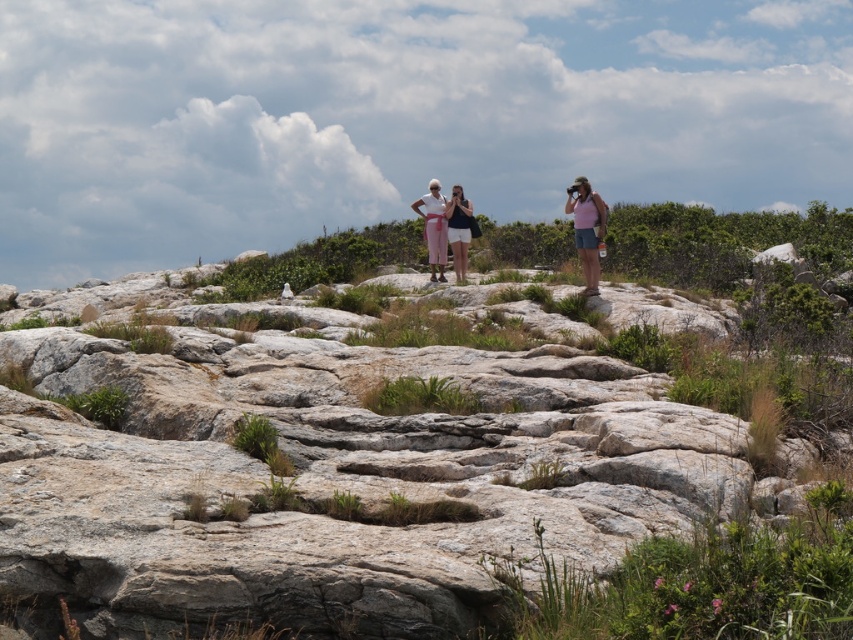
Which is below, matte pink pants at center or matte white shorts at center?

matte white shorts at center is lower down.

Locate an element on the screen. The height and width of the screenshot is (640, 853). matte pink pants at center is located at coordinates (434, 227).

Does pink fabric at center have a larger size compared to matte pink pants at center?

No.

Can you confirm if pink fabric at center is positioned above matte pink pants at center?

No, pink fabric at center is not above matte pink pants at center.

Measure the distance between point (572, 202) and camera.

A distance of 20.63 meters exists between point (572, 202) and camera.

Image resolution: width=853 pixels, height=640 pixels. In order to click on pink fabric at center in this screenshot , I will do `click(585, 228)`.

Is pink fabric at center positioned behind matte white shorts at center?

That is False.

Between point (577, 212) and point (461, 193), which one is positioned in front?

Point (577, 212) is more forward.

Find the location of a particular element. The image size is (853, 640). pink fabric at center is located at coordinates (585, 228).